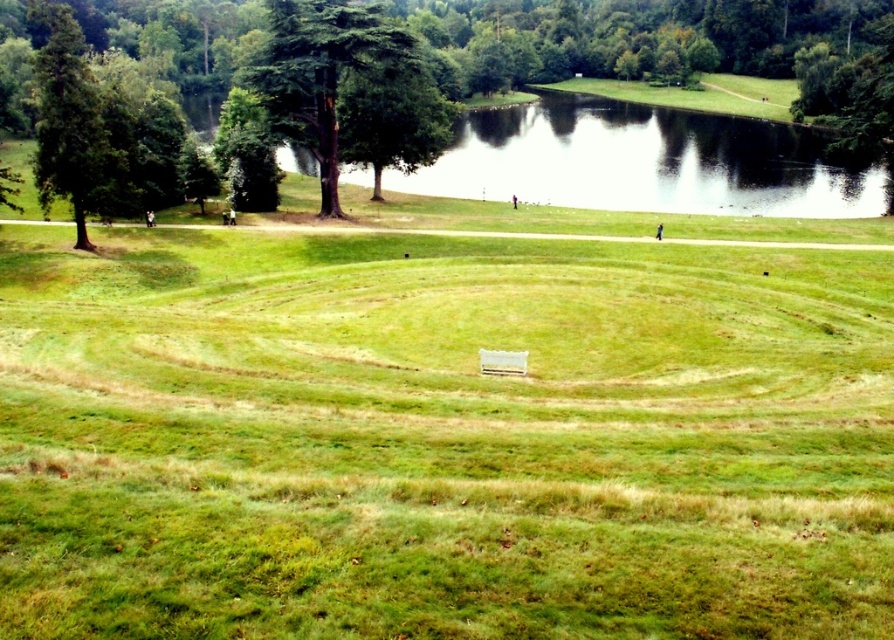
Question: Can you confirm if green leafy tree at center is bigger than green matte tree at left?

Choices:
 (A) no
 (B) yes

Answer: (A)

Question: Which point appears farthest from the camera in this image?

Choices:
 (A) (91, 93)
 (B) (49, 19)
 (C) (276, 108)

Answer: (C)

Question: Can you confirm if green leafy tree at center is positioned below green matte tree at left?

Choices:
 (A) no
 (B) yes

Answer: (B)

Question: Which object is the closest to the green leafy tree at center?

Choices:
 (A) green leafy tree at upper left
 (B) green matte tree at left

Answer: (B)

Question: Does green leafy tree at upper left appear over green matte tree at left?

Choices:
 (A) no
 (B) yes

Answer: (B)

Question: Which point is farther to the camera?

Choices:
 (A) (881, 131)
 (B) (41, 161)
 (C) (412, 141)

Answer: (C)